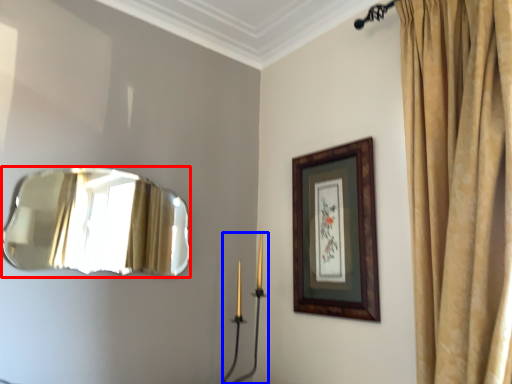
Question: Which object is further to the camera taking this photo, mirror (highlighted by a red box) or candle holder (highlighted by a blue box)?

Choices:
 (A) mirror
 (B) candle holder

Answer: (B)